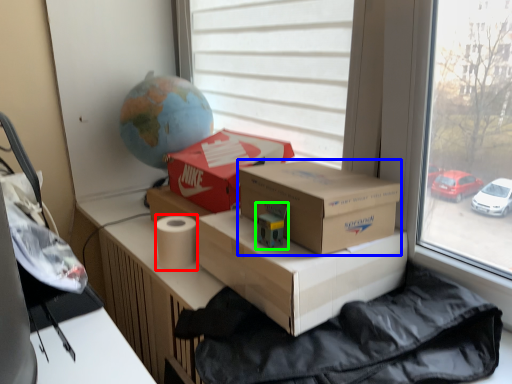
Question: Which object is the farthest from toilet paper (highlighted by a red box)? Choose among these: box (highlighted by a blue box) or toy (highlighted by a green box).

Choices:
 (A) box
 (B) toy

Answer: (A)